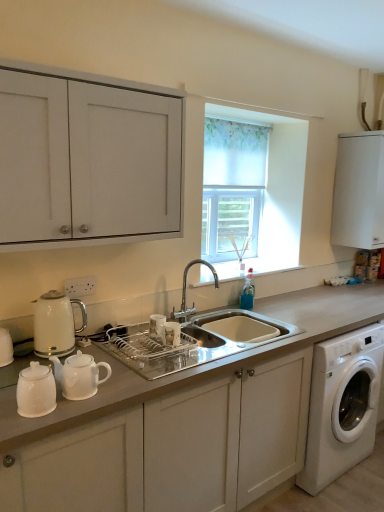
Question: Is white matte cabinet at center, the 2th cabinetry when ordered from right to left, looking in the opposite direction of translucent fabric at center?

Choices:
 (A) yes
 (B) no

Answer: (B)

Question: Is translucent fabric at center located within white matte cabinet at center, placed as the third cabinetry when sorted from top to bottom?

Choices:
 (A) no
 (B) yes

Answer: (A)

Question: Does white matte cabinet at center, placed as the third cabinetry when sorted from top to bottom, have a smaller size compared to translucent fabric at center?

Choices:
 (A) no
 (B) yes

Answer: (A)

Question: Is white matte cabinet at center, placed as the 2th cabinetry when sorted from left to right, in front of translucent fabric at center?

Choices:
 (A) yes
 (B) no

Answer: (A)

Question: Considering the relative sizes of white matte cabinet at center, the 2th cabinetry when ordered from right to left, and translucent fabric at center in the image provided, is white matte cabinet at center, the 2th cabinetry when ordered from right to left, wider than translucent fabric at center?

Choices:
 (A) no
 (B) yes

Answer: (B)

Question: From a real-world perspective, is white matte cabinet at center, placed as the 2th cabinetry when sorted from left to right, below translucent fabric at center?

Choices:
 (A) yes
 (B) no

Answer: (A)

Question: Does white plastic washing machine at lower right come in front of white glossy teapot at lower left?

Choices:
 (A) yes
 (B) no

Answer: (B)

Question: Is white plastic washing machine at lower right oriented away from white glossy teapot at lower left?

Choices:
 (A) yes
 (B) no

Answer: (B)

Question: Considering the relative positions of white plastic washing machine at lower right and white glossy teapot at lower left in the image provided, is white plastic washing machine at lower right to the right of white glossy teapot at lower left from the viewer's perspective?

Choices:
 (A) yes
 (B) no

Answer: (A)

Question: Considering the relative positions of white plastic washing machine at lower right and white glossy teapot at lower left in the image provided, is white plastic washing machine at lower right to the left of white glossy teapot at lower left from the viewer's perspective?

Choices:
 (A) no
 (B) yes

Answer: (A)

Question: From a real-world perspective, is white plastic washing machine at lower right located higher than white glossy teapot at lower left?

Choices:
 (A) yes
 (B) no

Answer: (B)

Question: Is white plastic washing machine at lower right behind white glossy teapot at lower left?

Choices:
 (A) yes
 (B) no

Answer: (A)

Question: Is white glossy electric kettle at left positioned beyond the bounds of white matte cabinet at upper right, arranged as the third cabinetry when viewed from the left?

Choices:
 (A) no
 (B) yes

Answer: (B)